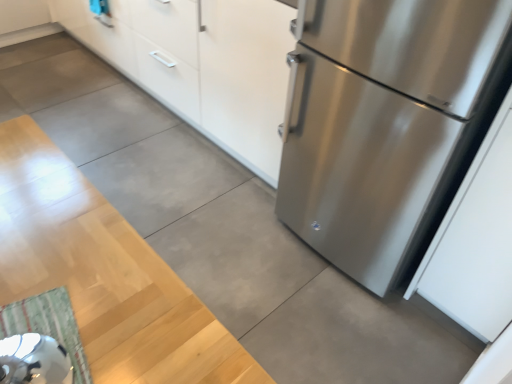
Question: Would you say white matte cabinet at upper center is part of green striped rug at lower left's contents?

Choices:
 (A) no
 (B) yes

Answer: (A)

Question: Considering the relative sizes of green striped rug at lower left and white matte cabinet at upper center in the image provided, is green striped rug at lower left bigger than white matte cabinet at upper center?

Choices:
 (A) yes
 (B) no

Answer: (B)

Question: From the image's perspective, would you say green striped rug at lower left is shown under white matte cabinet at upper center?

Choices:
 (A) yes
 (B) no

Answer: (A)

Question: Is green striped rug at lower left turned away from white matte cabinet at upper center?

Choices:
 (A) yes
 (B) no

Answer: (B)

Question: From the image's perspective, is green striped rug at lower left on white matte cabinet at upper center?

Choices:
 (A) no
 (B) yes

Answer: (A)

Question: Considering the positions of stainless steel refrigerator at right and white matte cabinet at upper center in the image, is stainless steel refrigerator at right taller or shorter than white matte cabinet at upper center?

Choices:
 (A) tall
 (B) short

Answer: (A)

Question: From a real-world perspective, relative to white matte cabinet at upper center, is stainless steel refrigerator at right vertically above or below?

Choices:
 (A) below
 (B) above

Answer: (B)

Question: Considering their positions, is stainless steel refrigerator at right located in front of or behind white matte cabinet at upper center?

Choices:
 (A) behind
 (B) front

Answer: (B)

Question: Is point (336, 246) closer or farther from the camera than point (220, 120)?

Choices:
 (A) farther
 (B) closer

Answer: (B)

Question: Is point (180, 62) positioned closer to the camera than point (343, 16)?

Choices:
 (A) farther
 (B) closer

Answer: (A)

Question: Is white matte cabinet at upper center wider or thinner than stainless steel refrigerator at right?

Choices:
 (A) thin
 (B) wide

Answer: (A)

Question: Do you think white matte cabinet at upper center is within stainless steel refrigerator at right, or outside of it?

Choices:
 (A) outside
 (B) inside

Answer: (A)

Question: Considering the positions of white matte cabinet at upper center and stainless steel refrigerator at right in the image, is white matte cabinet at upper center taller or shorter than stainless steel refrigerator at right?

Choices:
 (A) short
 (B) tall

Answer: (A)

Question: Is point (x=257, y=97) positioned closer to the camera than point (x=1, y=306)?

Choices:
 (A) farther
 (B) closer

Answer: (A)

Question: Relative to green striped rug at lower left, is white matte cabinet at upper center in front or behind?

Choices:
 (A) behind
 (B) front

Answer: (A)